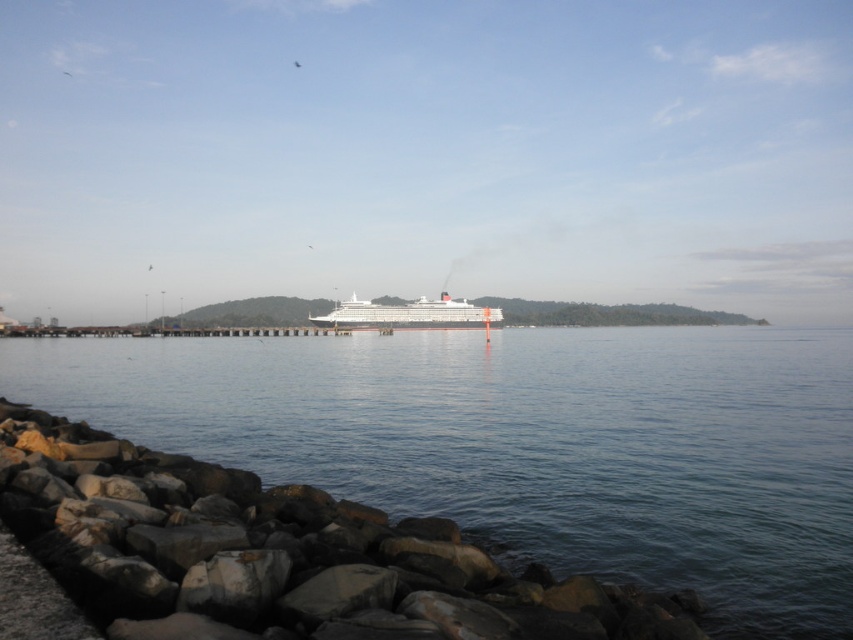
In the scene shown: Which is below, clear blue water at lower center or white glossy cruise ship at center?

Positioned lower is clear blue water at lower center.

Find the location of a particular element. The image size is (853, 640). clear blue water at lower center is located at coordinates (525, 438).